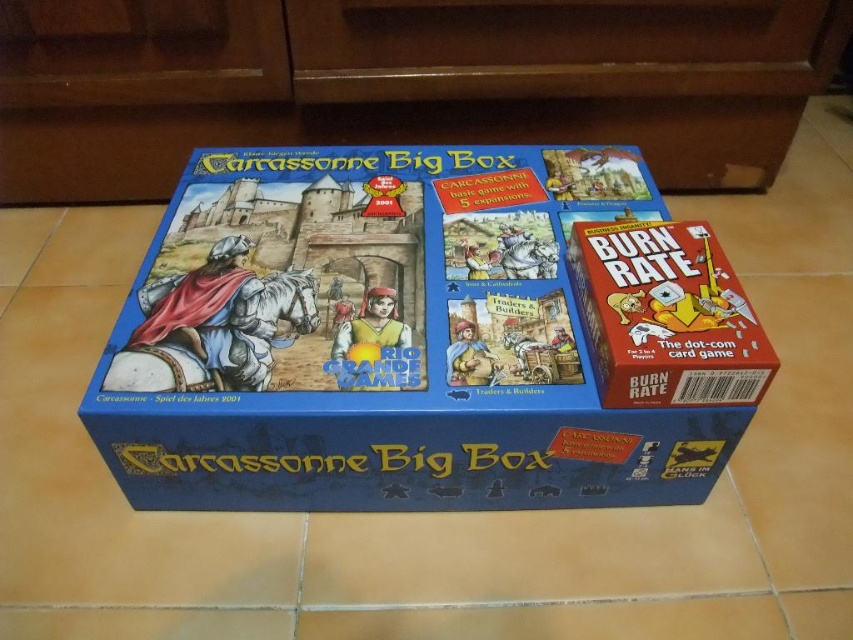
Is blue cardboard carcassonne big box at center smaller than matte cardboard box at right?

No, blue cardboard carcassonne big box at center is not smaller than matte cardboard box at right.

Is point (608, 465) farther from camera compared to point (674, 234)?

No, (608, 465) is closer to viewer.

Where is `blue cardboard carcassonne big box at center`? blue cardboard carcassonne big box at center is located at coordinates (425, 337).